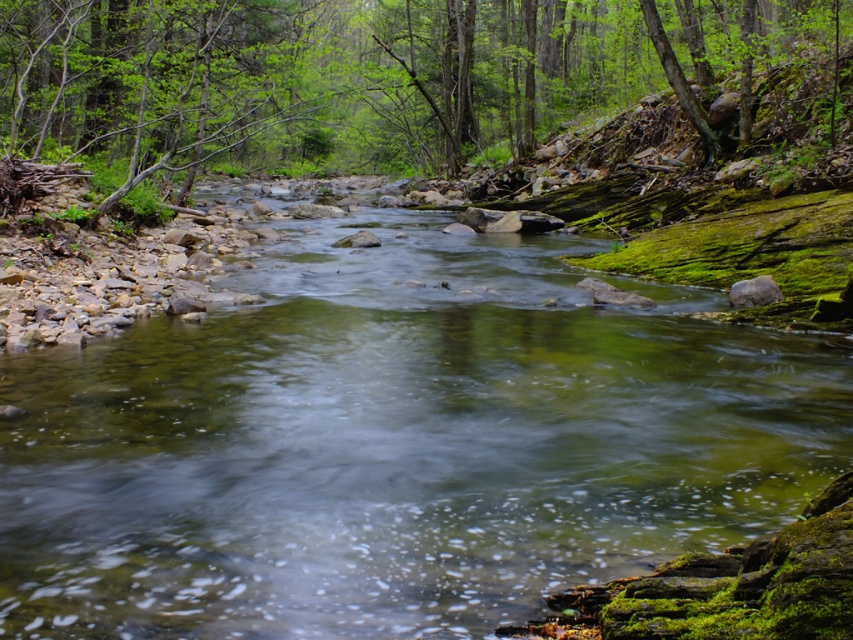
You are standing at the origin point of the image coordinate system, which is the bottom left corner. You want to find the clear water at center. In which direction should you move to reach it?

The clear water at center is located at point 0.692 on the x axis and 0.467 on the y axis. Since the origin is at the bottom left corner, moving right along the x axis and up along the y axis will reach the clear water at center.

You are standing at the edge of the forest stream and see the clear water at center and the green leafy tree at upper center. Which object is positioned to the right of the other?

The clear water at center is to the right of the green leafy tree at upper center.